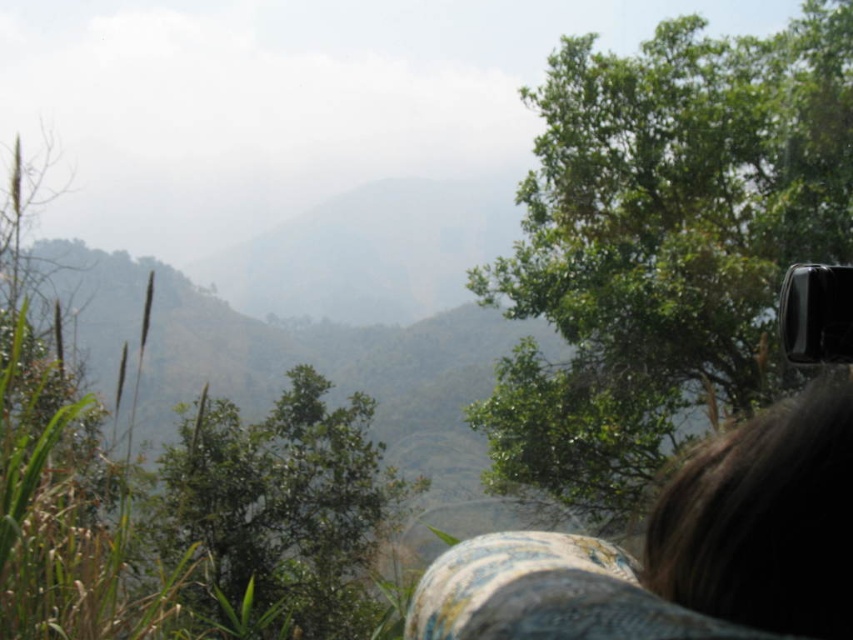
You are a hiker trying to navigate through the mountain trail. You notice a green leafy tree at upper right and a green leafy tree at center. Which tree is closer to you?

The green leafy tree at upper right is closer to you because it is positioned further to the viewer than the green leafy tree at center.